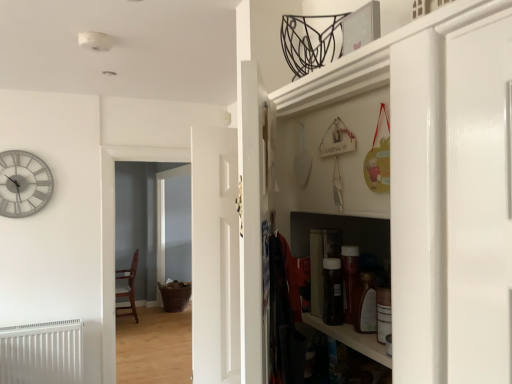
Question: From a real-world perspective, is white glossy cabinet at right physically above brown woven basket at center?

Choices:
 (A) no
 (B) yes

Answer: (B)

Question: Does white glossy cabinet at right come behind brown woven basket at center?

Choices:
 (A) yes
 (B) no

Answer: (B)

Question: From a real-world perspective, is white glossy cabinet at right below brown woven basket at center?

Choices:
 (A) no
 (B) yes

Answer: (A)

Question: From the image's perspective, is white glossy cabinet at right below brown woven basket at center?

Choices:
 (A) yes
 (B) no

Answer: (B)

Question: From the image's perspective, would you say white glossy cabinet at right is positioned over brown woven basket at center?

Choices:
 (A) yes
 (B) no

Answer: (A)

Question: Are white glossy cabinet at right and brown woven basket at center located far from each other?

Choices:
 (A) yes
 (B) no

Answer: (A)

Question: Considering the relative sizes of white painted wood door at center, the 1th door from the left, and white matte radiator at lower left in the image provided, is white painted wood door at center, the 1th door from the left, taller than white matte radiator at lower left?

Choices:
 (A) yes
 (B) no

Answer: (A)

Question: Does white painted wood door at center, the second door when ordered from right to left, lie behind white matte radiator at lower left?

Choices:
 (A) no
 (B) yes

Answer: (B)

Question: From a real-world perspective, is white painted wood door at center, the second door when ordered from right to left, located beneath white matte radiator at lower left?

Choices:
 (A) yes
 (B) no

Answer: (B)

Question: Is white painted wood door at center, arranged as the first door when viewed from the back, outside white matte radiator at lower left?

Choices:
 (A) no
 (B) yes

Answer: (B)

Question: From the image's perspective, would you say white painted wood door at center, the 1th door from the left, is shown under white matte radiator at lower left?

Choices:
 (A) no
 (B) yes

Answer: (A)

Question: From a real-world perspective, is white painted wood door at center, the 2th door viewed from the front, on white matte radiator at lower left?

Choices:
 (A) no
 (B) yes

Answer: (B)

Question: Are white matte radiator at lower left and brown woven basket at center beside each other?

Choices:
 (A) yes
 (B) no

Answer: (B)